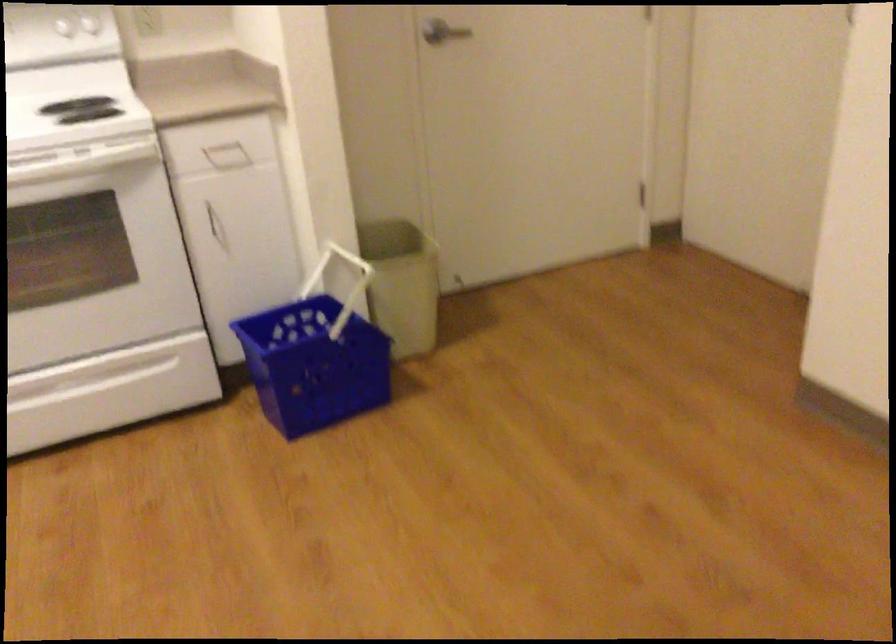
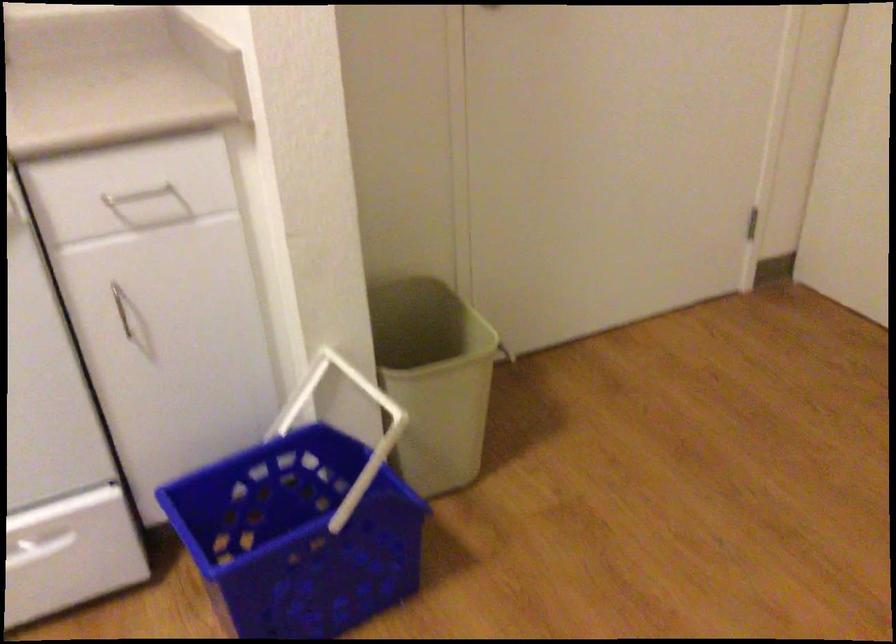
Question: I am providing you with two images of the same scene from different viewpoints. After the viewpoint changes to image2, which objects are now occluded?

Choices:
 (A) silver cabinet handle
 (B) light-colored trash can
 (C) white basket handle
 (D) none of these

Answer: (D)